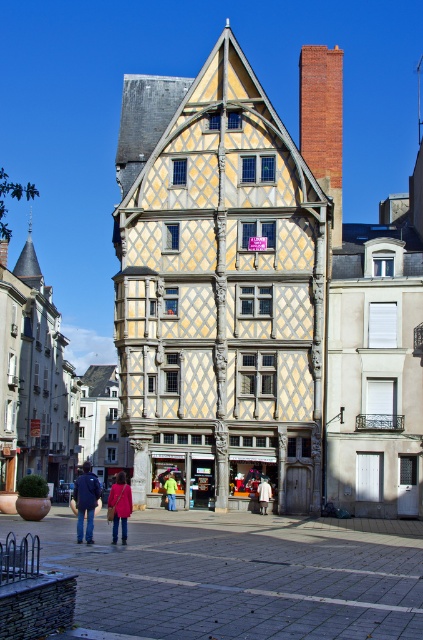
Question: Which point appears closest to the camera in this image?

Choices:
 (A) (87, 468)
 (B) (125, 480)
 (C) (57, 556)
 (D) (261, 480)

Answer: (C)

Question: Considering the relative positions of white cotton shirt at center and green fabric jacket at center in the image provided, where is white cotton shirt at center located with respect to green fabric jacket at center?

Choices:
 (A) left
 (B) right

Answer: (B)

Question: Among these objects, which one is nearest to the camera?

Choices:
 (A) green fabric jacket at center
 (B) white cotton shirt at center
 (C) pink fabric coat at lower center

Answer: (C)

Question: Observing the image, what is the correct spatial positioning of blue denim jacket at lower left in reference to white cotton shirt at center?

Choices:
 (A) left
 (B) right

Answer: (A)

Question: From the image, what is the correct spatial relationship of white cotton shirt at center in relation to green fabric jacket at center?

Choices:
 (A) below
 (B) above

Answer: (B)

Question: Which object appears closest to the camera in this image?

Choices:
 (A) white cotton shirt at center
 (B) blue denim jacket at lower left

Answer: (B)